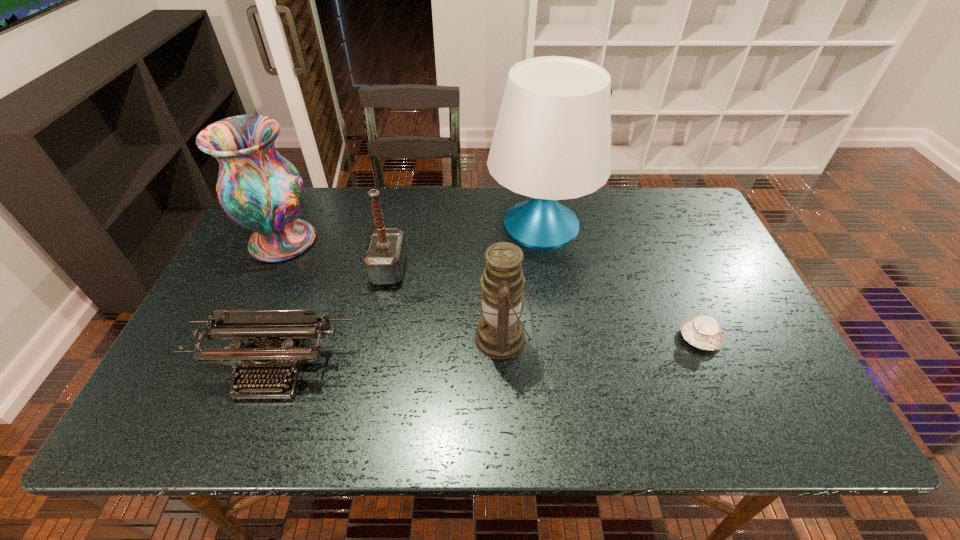
Locate an element on the screen. The height and width of the screenshot is (540, 960). free space that satisfies the following two spatial constraints: 1. on the front-facing side of the table lamp; 2. on the front side of the vase is located at coordinates pyautogui.click(x=543, y=241).